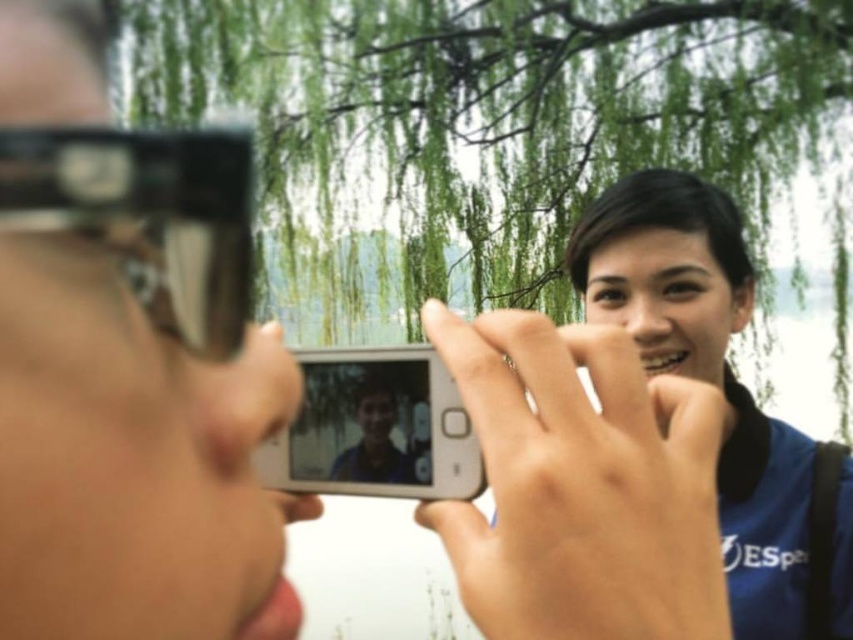
Between green leafy tree at upper center and matte black goggles at upper left, which one has less height?

matte black goggles at upper left is shorter.

Find the location of `green leafy tree at upper center`. green leafy tree at upper center is located at coordinates (508, 118).

The width and height of the screenshot is (853, 640). What are the coordinates of `green leafy tree at upper center` in the screenshot? It's located at (508, 118).

Does green leafy tree at upper center appear on the right side of white glossy smartphone at center?

Yes, green leafy tree at upper center is to the right of white glossy smartphone at center.

Between green leafy tree at upper center and white glossy smartphone at center, which one appears on the right side from the viewer's perspective?

green leafy tree at upper center

The width and height of the screenshot is (853, 640). Find the location of `green leafy tree at upper center`. green leafy tree at upper center is located at coordinates (508, 118).

Is point (178, 212) positioned in front of point (325, 369)?

That is True.

Who is more distant from viewer, (55, 220) or (442, 422)?

Point (442, 422)

At what (x,y) coordinates should I click in order to perform the action: click on matte black goggles at upper left. Please return your answer as a coordinate pair (x, y). The width and height of the screenshot is (853, 640). Looking at the image, I should click on (148, 216).